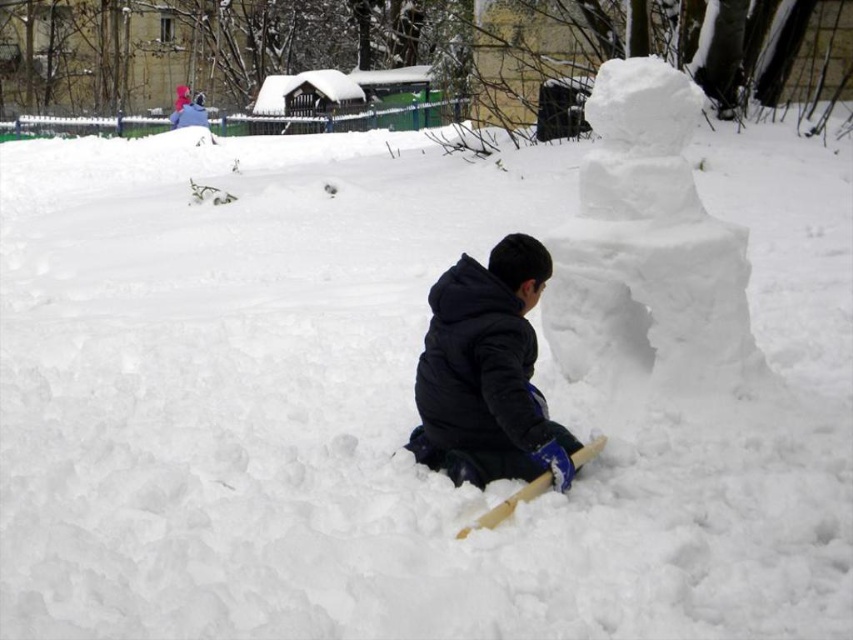
Question: Which object is closer to the camera taking this photo?

Choices:
 (A) white fluffy snowman at upper right
 (B) black fleece jacket at center

Answer: (B)

Question: Can you confirm if white fluffy snowman at upper right is positioned below black fleece jacket at center?

Choices:
 (A) yes
 (B) no

Answer: (B)

Question: Is white fluffy snowman at upper right further to the viewer compared to black fleece jacket at center?

Choices:
 (A) no
 (B) yes

Answer: (B)

Question: Which of the following is the closest to the observer?

Choices:
 (A) (432, 336)
 (B) (665, 385)

Answer: (A)

Question: Is white fluffy snowman at upper right below black fleece jacket at center?

Choices:
 (A) no
 (B) yes

Answer: (A)